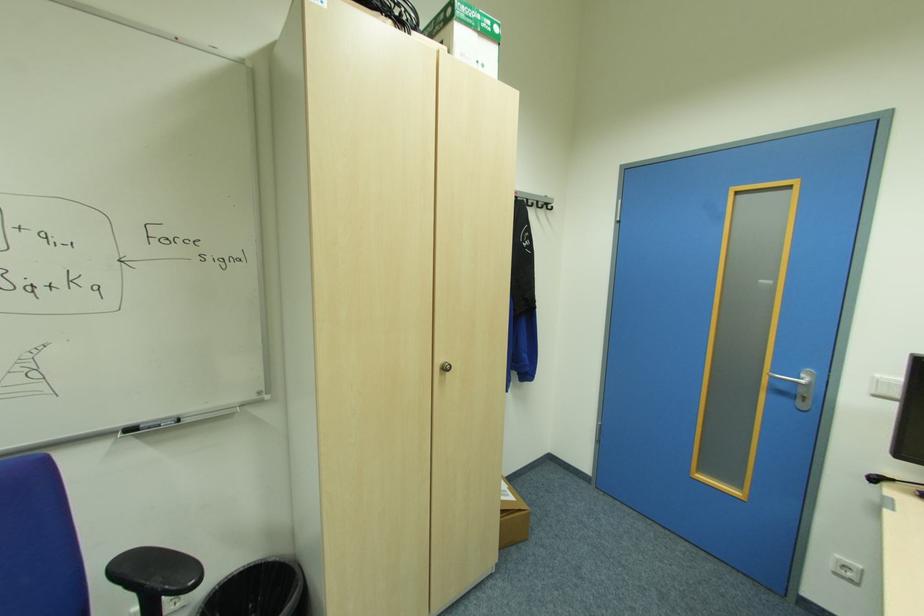
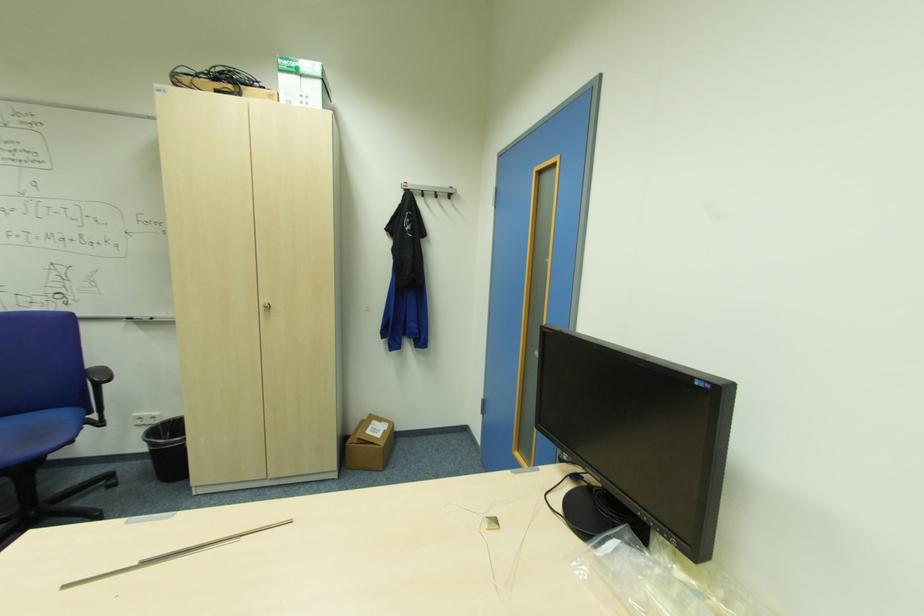
Find the pixel in the second image that matches pixel 447 368 in the first image.

(271, 307)